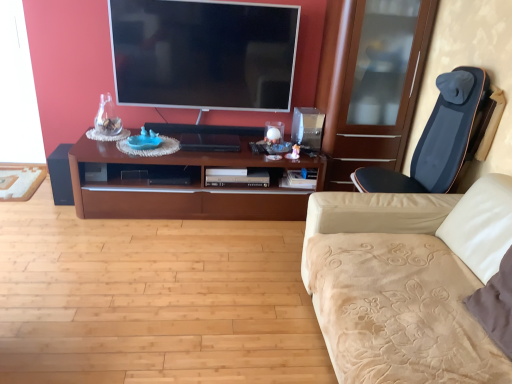
Question: From a real-world perspective, is brown wood cabinet at center positioned above or below dark blue fabric massage chair at right?

Choices:
 (A) below
 (B) above

Answer: (A)

Question: Is brown wood cabinet at center situated inside dark blue fabric massage chair at right or outside?

Choices:
 (A) inside
 (B) outside

Answer: (B)

Question: Based on their relative distances, which object is nearer to the beige velvety studio couch at right?

Choices:
 (A) flat screen tv at upper center
 (B) black matte speaker at left
 (C) dark blue fabric massage chair at right
 (D) brown wood cabinet at center

Answer: (C)

Question: Which object is the farthest from the flat screen tv at upper center?

Choices:
 (A) black matte speaker at left
 (B) brown wood cabinet at center
 (C) beige velvety studio couch at right
 (D) dark blue fabric massage chair at right

Answer: (C)